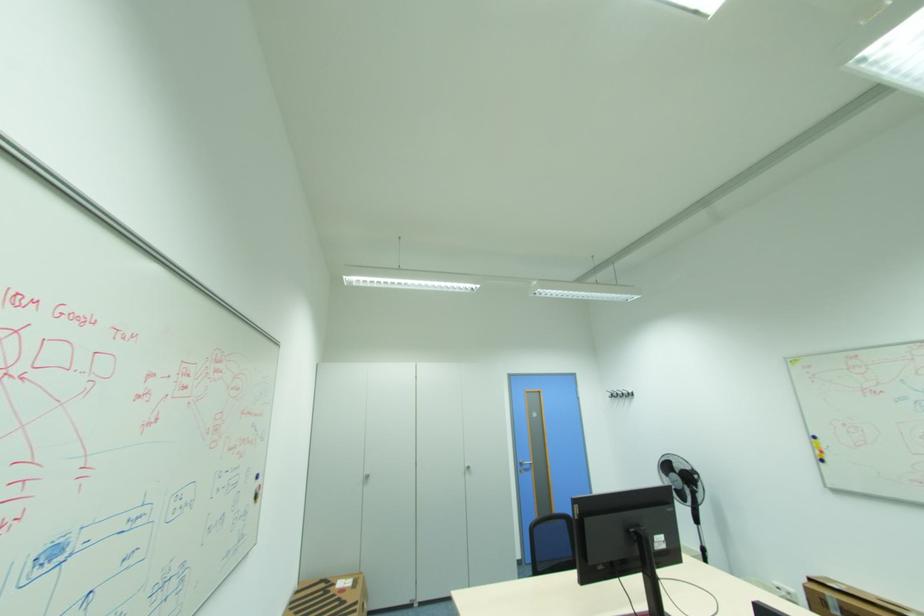
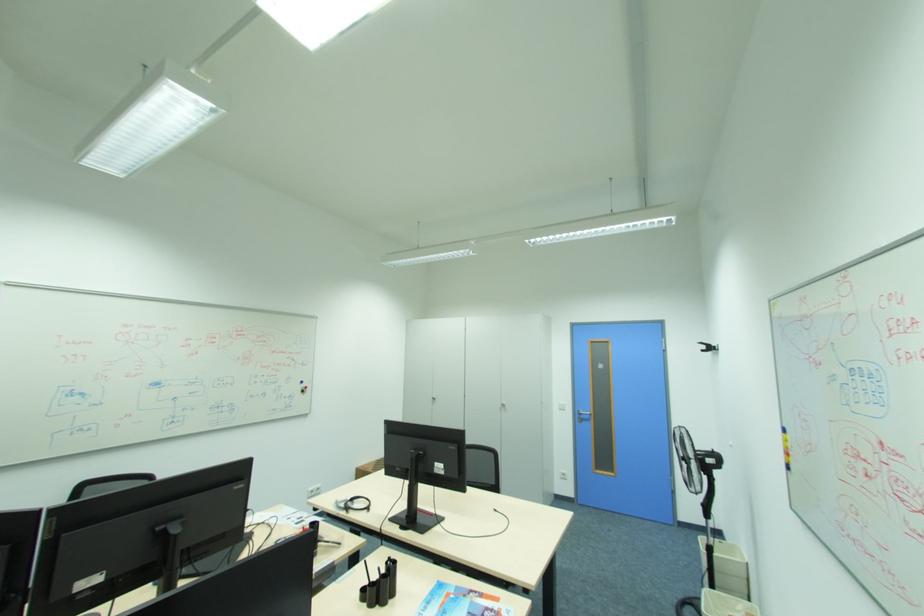
In the second image, find the point that corresponds to the point at 529,467 in the first image.

(588, 416)